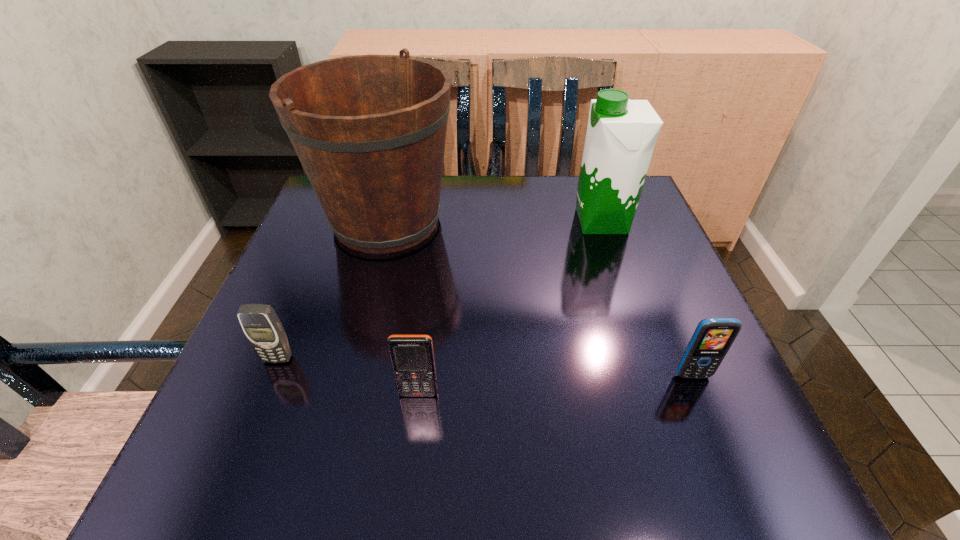
Find the location of a particular element. The image size is (960, 540). cellular telephone that is the second closest one to the second farthest cellular telephone is located at coordinates (260, 323).

Identify which cellular telephone is located as the second nearest to the nearest object. Please provide its 2D coordinates. Your answer should be formatted as a tuple, i.e. [(x, y)], where the tuple contains the x and y coordinates of a point satisfying the conditions above.

[(713, 337)]

Identify the location of free spot that satisfies the following two spatial constraints: 1. on the front-facing side of the soya milk; 2. on the front face of the leftmost cellular telephone. (649, 359).

Identify the location of vacant point that satisfies the following two spatial constraints: 1. on the front-facing side of the soya milk; 2. on the front face of the third farthest object. Image resolution: width=960 pixels, height=540 pixels. (649, 359).